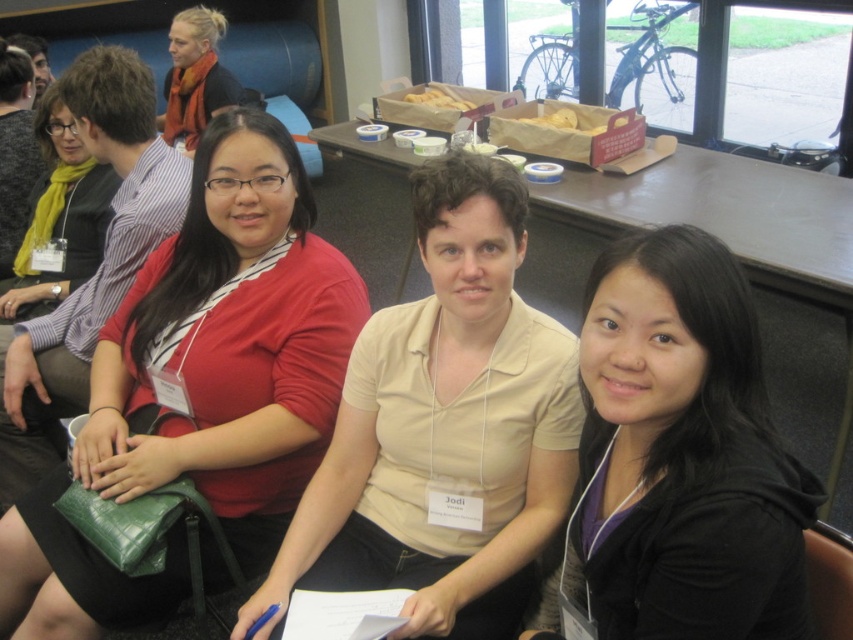
What are the coordinates of the matte red sweater at center in the image?

The coordinates of the matte red sweater at center are at point (229, 342).

You are a photographer setting up for a group photo. You have a camera on a tripod placed behind the smooth wooden table at center. You want to capture the matte orange scarf at upper left in your frame. Is the scarf visible in the camera view?

The smooth wooden table at center is in front of the matte orange scarf at upper left, so the scarf might be partially or fully blocked by the table and not visible in the camera view.

You are organizing a photo shoot and need to place a decorative item between the black matte jacket at lower right and the matte orange scarf at upper left. Which object should the item be placed closer to if you want it to be near the narrower one?

The black matte jacket at lower right has a lesser width compared to the matte orange scarf at upper left, so the decorative item should be placed closer to the black matte jacket at lower right.